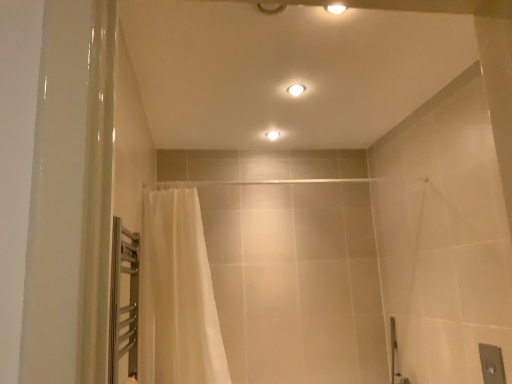
You are a GUI agent. You are given a task and a screenshot of the screen. Output one action in this format:
    pyautogui.click(x=<x>, y=<y>)
    Task: Click on the white glossy light fixture at upper center, the 2th light fixture from the back
    This screenshot has height=384, width=512.
    Given the screenshot: What is the action you would take?
    pyautogui.click(x=296, y=89)

What do you see at coordinates (296, 89) in the screenshot? I see `white glossy light fixture at upper center, the 2th light fixture from the back` at bounding box center [296, 89].

What is the approximate width of matte white ceiling light at center, which is the 2th light fixture from top to bottom?

The width of matte white ceiling light at center, which is the 2th light fixture from top to bottom, is 10.15 centimeters.

Identify the location of white glossy light fixture at upper center, placed as the second light fixture when sorted from bottom to top. (296, 89).

From a real-world perspective, relative to white glossy light fixture at upper center, placed as the 2th light fixture when sorted from left to right, is matte white ceiling light at center, the 1th light fixture viewed from the back, vertically above or below?

Clearly, from a real-world perspective, matte white ceiling light at center, the 1th light fixture viewed from the back, is below white glossy light fixture at upper center, placed as the 2th light fixture when sorted from left to right.

Does matte white ceiling light at center, arranged as the 2th light fixture when viewed from the front, turn towards white glossy light fixture at upper center, placed as the 2th light fixture when sorted from left to right?

Yes, matte white ceiling light at center, arranged as the 2th light fixture when viewed from the front, is facing white glossy light fixture at upper center, placed as the 2th light fixture when sorted from left to right.

Can you tell me how much matte white ceiling light at center, arranged as the 2th light fixture when viewed from the front, and white glossy light fixture at upper center, placed as the 2th light fixture when sorted from left to right, differ in facing direction?

The facing directions of matte white ceiling light at center, arranged as the 2th light fixture when viewed from the front, and white glossy light fixture at upper center, placed as the 2th light fixture when sorted from left to right, are 0.00038 degrees apart.

Is white glossy light fixture at upper center, the 2th light fixture from the back, to the right of white sheer curtain at left from the viewer's perspective?

Indeed, white glossy light fixture at upper center, the 2th light fixture from the back, is positioned on the right side of white sheer curtain at left.

Looking at their sizes, would you say white glossy light fixture at upper center, placed as the second light fixture when sorted from bottom to top, is wider or thinner than white sheer curtain at left?

white glossy light fixture at upper center, placed as the second light fixture when sorted from bottom to top, is thinner than white sheer curtain at left.

Do you think white glossy light fixture at upper center, placed as the second light fixture when sorted from bottom to top, is within white sheer curtain at left, or outside of it?

white glossy light fixture at upper center, placed as the second light fixture when sorted from bottom to top, exists outside the volume of white sheer curtain at left.

Between point (287, 89) and point (217, 360), which one is positioned in front?

The point (217, 360) is closer.

Where is `light fixture below the white glossy light fixture at upper center, acting as the first light fixture starting from the right (from a real-world perspective)`? The height and width of the screenshot is (384, 512). light fixture below the white glossy light fixture at upper center, acting as the first light fixture starting from the right (from a real-world perspective) is located at coordinates (272, 135).

Is white glossy light fixture at upper center, the 2th light fixture from the back, positioned far away from matte white ceiling light at center, which is the 2th light fixture in right-to-left order?

They are positioned close to each other.

Between white glossy light fixture at upper center, which is the 1th light fixture from top to bottom, and matte white ceiling light at center, arranged as the first light fixture when viewed from the left, which one has larger width?

white glossy light fixture at upper center, which is the 1th light fixture from top to bottom.

Consider the image. Is matte white ceiling light at center, arranged as the 2th light fixture when viewed from the front, beside white sheer curtain at left?

No.

Can you confirm if matte white ceiling light at center, the 1th light fixture viewed from the back, is wider than white sheer curtain at left?

In fact, matte white ceiling light at center, the 1th light fixture viewed from the back, might be narrower than white sheer curtain at left.

Is point (277, 136) behind point (158, 247)?

Yes, it is.

Visually, is matte white ceiling light at center, which is the 2th light fixture from top to bottom, positioned to the left or to the right of white sheer curtain at left?

In the image, matte white ceiling light at center, which is the 2th light fixture from top to bottom, appears on the right side of white sheer curtain at left.

Measure the distance from white sheer curtain at left to white glossy light fixture at upper center, the 2th light fixture from the back.

white sheer curtain at left and white glossy light fixture at upper center, the 2th light fixture from the back, are 4.08 feet apart from each other.

Considering the positions of objects white sheer curtain at left and white glossy light fixture at upper center, the 2th light fixture from the back, in the image provided, who is more to the right, white sheer curtain at left or white glossy light fixture at upper center, the 2th light fixture from the back,?

From the viewer's perspective, white glossy light fixture at upper center, the 2th light fixture from the back, appears more on the right side.

Considering the sizes of objects white sheer curtain at left and white glossy light fixture at upper center, acting as the first light fixture starting from the right, in the image provided, who is wider, white sheer curtain at left or white glossy light fixture at upper center, acting as the first light fixture starting from the right,?

Wider between the two is white sheer curtain at left.

Between white sheer curtain at left and white glossy light fixture at upper center, placed as the second light fixture when sorted from bottom to top, which one has larger size?

Bigger between the two is white sheer curtain at left.

Is white sheer curtain at left to the left or to the right of matte white ceiling light at center, arranged as the 2th light fixture when viewed from the front, in the image?

From the image, it's evident that white sheer curtain at left is to the left of matte white ceiling light at center, arranged as the 2th light fixture when viewed from the front.

Which object is more forward, white sheer curtain at left or matte white ceiling light at center, the 1th light fixture viewed from the back?

Positioned in front is white sheer curtain at left.

How different are the orientations of white sheer curtain at left and matte white ceiling light at center, marked as the 1th light fixture in a bottom-to-top arrangement, in degrees?

The facing directions of white sheer curtain at left and matte white ceiling light at center, marked as the 1th light fixture in a bottom-to-top arrangement, are 11.6 degrees apart.

Where is `light fixture below the white glossy light fixture at upper center, placed as the 2th light fixture when sorted from left to right (from the image's perspective)`? light fixture below the white glossy light fixture at upper center, placed as the 2th light fixture when sorted from left to right (from the image's perspective) is located at coordinates (272, 135).

Identify the location of curtain that is in front of the white glossy light fixture at upper center, acting as the first light fixture starting from the right. (177, 294).

Based on their spatial positions, is white sheer curtain at left or white glossy light fixture at upper center, acting as the first light fixture starting from the right, closer to matte white ceiling light at center, the 1th light fixture viewed from the back?

Among the two, white glossy light fixture at upper center, acting as the first light fixture starting from the right, is located nearer to matte white ceiling light at center, the 1th light fixture viewed from the back.

When comparing their distances from white sheer curtain at left, does matte white ceiling light at center, the 1th light fixture viewed from the back, or white glossy light fixture at upper center, acting as the first light fixture starting from the right, seem further?

Among the two, matte white ceiling light at center, the 1th light fixture viewed from the back, is located further to white sheer curtain at left.

Which object lies nearer to the anchor point white glossy light fixture at upper center, which is the first light fixture from front to back, white sheer curtain at left or matte white ceiling light at center, marked as the 1th light fixture in a bottom-to-top arrangement?

matte white ceiling light at center, marked as the 1th light fixture in a bottom-to-top arrangement, is closer to white glossy light fixture at upper center, which is the first light fixture from front to back.

Estimate the real-world distances between objects in this image. Which object is closer to matte white ceiling light at center, which is the 2th light fixture from top to bottom, white glossy light fixture at upper center, which is the first light fixture from front to back, or white sheer curtain at left?

white glossy light fixture at upper center, which is the first light fixture from front to back, is closer to matte white ceiling light at center, which is the 2th light fixture from top to bottom.

Estimate the real-world distances between objects in this image. Which object is further from white glossy light fixture at upper center, which is the 1th light fixture from top to bottom, matte white ceiling light at center, marked as the 1th light fixture in a bottom-to-top arrangement, or white sheer curtain at left?

The object further to white glossy light fixture at upper center, which is the 1th light fixture from top to bottom, is white sheer curtain at left.

Considering their positions, is white glossy light fixture at upper center, placed as the 2th light fixture when sorted from left to right, positioned further to white sheer curtain at left than matte white ceiling light at center, which is the 2th light fixture from top to bottom?

The object further to white sheer curtain at left is matte white ceiling light at center, which is the 2th light fixture from top to bottom.

The image size is (512, 384). I want to click on light fixture that lies between white glossy light fixture at upper center, which is the first light fixture from front to back, and white sheer curtain at left from top to bottom, so click(272, 135).